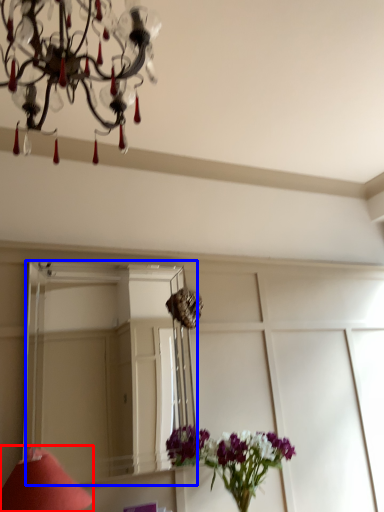
Question: Which point is closer to the camera, table lamp (highlighted by a red box) or mirror (highlighted by a blue box)?

Choices:
 (A) table lamp
 (B) mirror

Answer: (A)